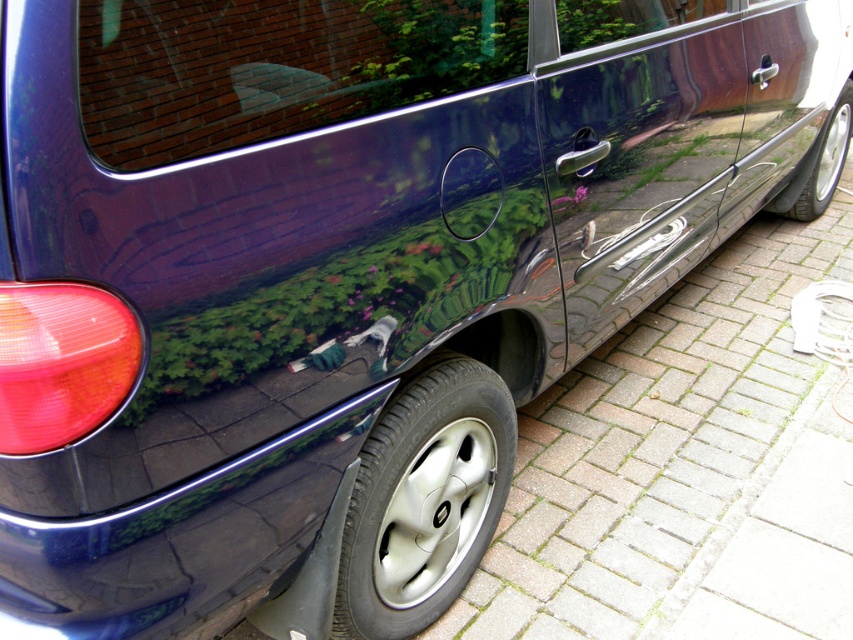
Question: Among these objects, which one is farthest from the camera?

Choices:
 (A) silver metallic tire at lower right
 (B) shiny metallic tire at right

Answer: (B)

Question: Observing the image, what is the correct spatial positioning of silver metallic tire at lower right in reference to shiny metallic tire at right?

Choices:
 (A) left
 (B) right

Answer: (A)

Question: Does silver metallic tire at lower right have a greater width compared to shiny metallic tire at right?

Choices:
 (A) yes
 (B) no

Answer: (B)

Question: Is silver metallic tire at lower right above shiny metallic tire at right?

Choices:
 (A) no
 (B) yes

Answer: (A)

Question: Which of the following is the closest to the observer?

Choices:
 (A) (454, 508)
 (B) (822, 154)

Answer: (A)